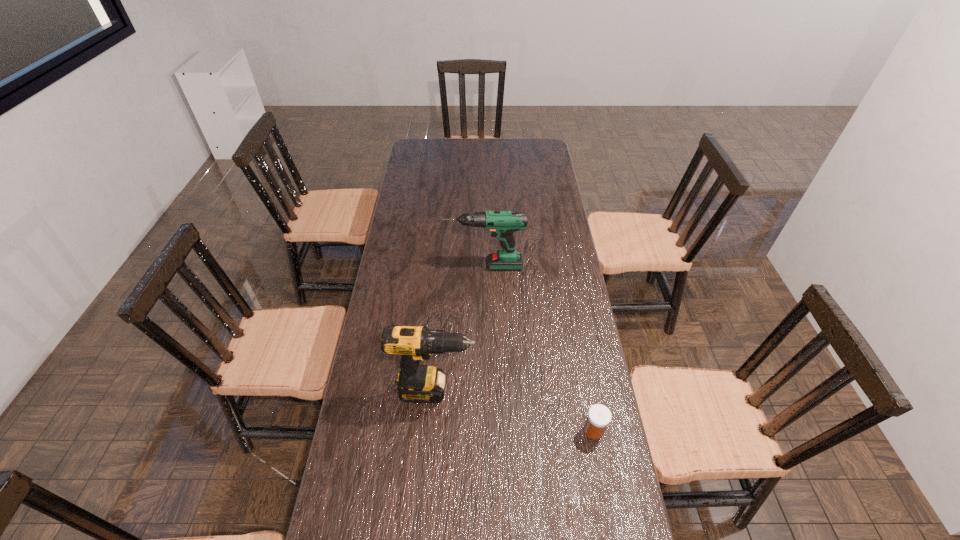
Locate an element on the screen. free space that is in between the farthest object and the medicine is located at coordinates (539, 348).

Locate an element on the screen. This screenshot has height=540, width=960. empty space between the second nearest object and the farther drill is located at coordinates (460, 328).

Locate which object is the second closest to the farther drill. Please provide its 2D coordinates. Your answer should be formatted as a tuple, i.e. [(x, y)], where the tuple contains the x and y coordinates of a point satisfying the conditions above.

[(599, 416)]

This screenshot has width=960, height=540. Identify the location of the second closest object to the nearer drill. (502, 224).

The image size is (960, 540). Identify the location of drill that stands as the closest to the nearest object. (418, 383).

You are a GUI agent. You are given a task and a screenshot of the screen. Output one action in this format:
    pyautogui.click(x=<x>, y=<y>)
    Task: Click on the vacant area in the image that satisfies the following two spatial constraints: 1. on the handle side of the farthest object; 2. on the left side of the shortest object
    
    Given the screenshot: What is the action you would take?
    pyautogui.click(x=486, y=431)

The width and height of the screenshot is (960, 540). Identify the location of free space that satisfies the following two spatial constraints: 1. on the handle side of the nearest object; 2. on the left side of the farthest object. (486, 431).

At what (x,y) coordinates should I click in order to perform the action: click on vacant space that satisfies the following two spatial constraints: 1. at the tip of the rightmost object; 2. on the left side of the second farthest object. Please return your answer as a coordinate pair (x, y). Image resolution: width=960 pixels, height=540 pixels. Looking at the image, I should click on (432, 431).

Locate an element on the screen. The image size is (960, 540). blank space that satisfies the following two spatial constraints: 1. on the back side of the rightmost object; 2. on the handle side of the farthest object is located at coordinates (563, 266).

This screenshot has width=960, height=540. What are the coordinates of `free location that satisfies the following two spatial constraints: 1. at the tip of the nearer drill; 2. on the right side of the shortest object` in the screenshot? It's located at (432, 431).